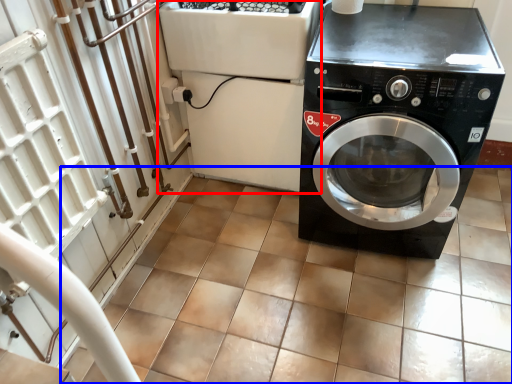
Question: Among these objects, which one is farthest to the camera, appliance (highlighted by a red box) or tile (highlighted by a blue box)?

Choices:
 (A) appliance
 (B) tile

Answer: (A)